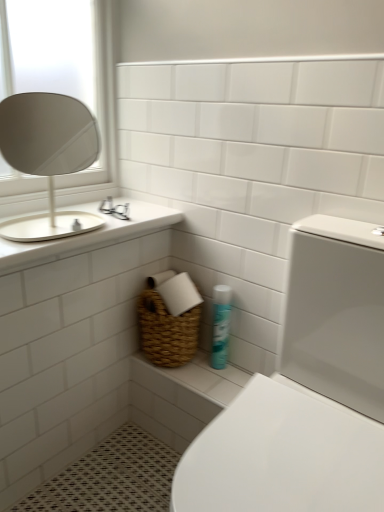
Question: Is blue glossy spray can at lower center completely or partially outside of white ceramic sink at upper left?

Choices:
 (A) no
 (B) yes

Answer: (B)

Question: Considering the relative positions of blue glossy spray can at lower center and white ceramic sink at upper left in the image provided, is blue glossy spray can at lower center in front of white ceramic sink at upper left?

Choices:
 (A) yes
 (B) no

Answer: (B)

Question: Is blue glossy spray can at lower center shorter than white ceramic sink at upper left?

Choices:
 (A) no
 (B) yes

Answer: (B)

Question: Is blue glossy spray can at lower center next to white ceramic sink at upper left and touching it?

Choices:
 (A) yes
 (B) no

Answer: (B)

Question: From the image's perspective, does blue glossy spray can at lower center appear lower than white ceramic sink at upper left?

Choices:
 (A) yes
 (B) no

Answer: (A)

Question: Do you think white glossy toilet at lower right is within white ceramic sink at upper left, or outside of it?

Choices:
 (A) inside
 (B) outside

Answer: (B)

Question: From a real-world perspective, is white glossy toilet at lower right above or below white ceramic sink at upper left?

Choices:
 (A) above
 (B) below

Answer: (B)

Question: Is white glossy toilet at lower right to the left or to the right of white ceramic sink at upper left in the image?

Choices:
 (A) right
 (B) left

Answer: (A)

Question: From the image's perspective, relative to white ceramic sink at upper left, is white glossy toilet at lower right above or below?

Choices:
 (A) above
 (B) below

Answer: (B)

Question: From a real-world perspective, is white ceramic sink at upper left above or below white glossy countertop at upper left?

Choices:
 (A) above
 (B) below

Answer: (A)

Question: Is point (82, 222) positioned closer to the camera than point (105, 244)?

Choices:
 (A) farther
 (B) closer

Answer: (B)

Question: In the image, is white ceramic sink at upper left positioned in front of or behind white glossy countertop at upper left?

Choices:
 (A) front
 (B) behind

Answer: (A)

Question: From the image's perspective, relative to white glossy countertop at upper left, is white ceramic sink at upper left above or below?

Choices:
 (A) above
 (B) below

Answer: (A)

Question: In terms of height, does woven basket at lower center look taller or shorter compared to white glossy countertop at upper left?

Choices:
 (A) tall
 (B) short

Answer: (B)

Question: From the image's perspective, relative to white glossy countertop at upper left, is woven basket at lower center above or below?

Choices:
 (A) above
 (B) below

Answer: (B)